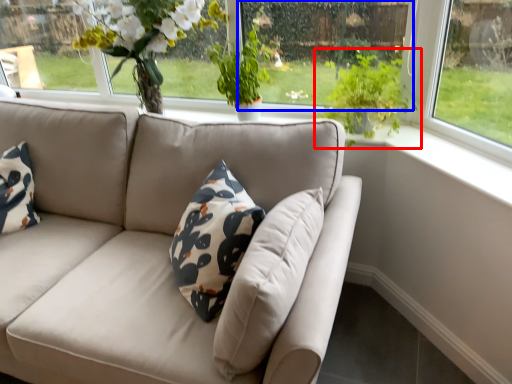
Question: Which of the following is the farthest to the observer, houseplant (highlighted by a red box) or window screen (highlighted by a blue box)?

Choices:
 (A) houseplant
 (B) window screen

Answer: (B)